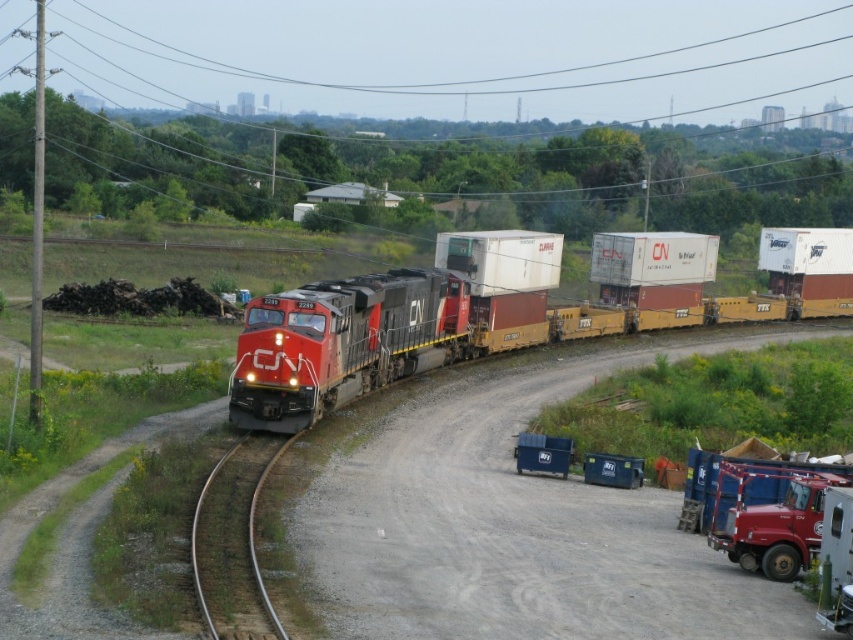
Question: Can you confirm if red glossy trailer truck at lower right is positioned below metal at left?

Choices:
 (A) no
 (B) yes

Answer: (A)

Question: Is red glossy locomotive at center wider than metal at left?

Choices:
 (A) yes
 (B) no

Answer: (A)

Question: Which object is closer to the camera taking this photo?

Choices:
 (A) metal at left
 (B) red glossy trailer truck at lower right

Answer: (A)

Question: Considering the real-world distances, which object is closest to the red glossy trailer truck at lower right?

Choices:
 (A) metal at left
 (B) red glossy locomotive at center

Answer: (A)

Question: Does red glossy locomotive at center lie behind red glossy trailer truck at lower right?

Choices:
 (A) no
 (B) yes

Answer: (B)

Question: Estimate the real-world distances between objects in this image. Which object is farther from the red glossy trailer truck at lower right?

Choices:
 (A) metal at left
 (B) red glossy locomotive at center

Answer: (B)